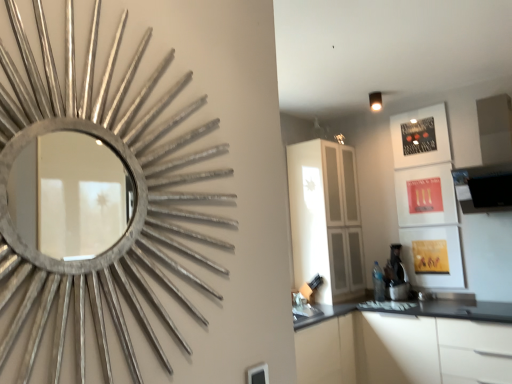
Measure the distance between silver metallic mirror at upper left and camera.

silver metallic mirror at upper left and camera are 73.79 centimeters apart from each other.

The height and width of the screenshot is (384, 512). What do you see at coordinates (396, 275) in the screenshot?
I see `black plastic coffee machine at lower right` at bounding box center [396, 275].

Measure the distance between point (300,343) and camera.

A distance of 2.94 meters exists between point (300,343) and camera.

You are a GUI agent. You are given a task and a screenshot of the screen. Output one action in this format:
    pyautogui.click(x=<x>, y=<y>)
    Task: Click on the white matte cabinet at lower right
    The height and width of the screenshot is (384, 512).
    Given the screenshot: What is the action you would take?
    [x=406, y=344]

Where is `silver metallic mirror at upper left`? The height and width of the screenshot is (384, 512). silver metallic mirror at upper left is located at coordinates (99, 206).

Which point is more distant from viewer, (390, 259) or (151, 211)?

The point (390, 259) is more distant.

Identify the location of oval that appears on the left of black plastic coffee machine at lower right. The height and width of the screenshot is (384, 512). (99, 206).

From a real-world perspective, between black plastic coffee machine at lower right and silver metallic mirror at upper left, who is vertically lower?

From a 3D spatial view, black plastic coffee machine at lower right is below.

Looking at this image, is black plastic coffee machine at lower right a part of silver metallic mirror at upper left?

Definitely not — black plastic coffee machine at lower right is not inside silver metallic mirror at upper left.

Which of these two, silver metallic mirror at upper left or black plastic coffee machine at lower right, stands shorter?

black plastic coffee machine at lower right is shorter.

Between silver metallic mirror at upper left and black plastic coffee machine at lower right, which one appears on the left side from the viewer's perspective?

silver metallic mirror at upper left.

From a real-world perspective, is white glossy cabinet at center located higher than white matte cabinet at lower right?

Yes.

Can you tell me how much white glossy cabinet at center and white matte cabinet at lower right differ in facing direction?

white glossy cabinet at center and white matte cabinet at lower right are facing 88.7 degrees away from each other.

Considering the sizes of objects white glossy cabinet at center and white matte cabinet at lower right in the image provided, who is bigger, white glossy cabinet at center or white matte cabinet at lower right?

white matte cabinet at lower right is bigger.

Is white matte cabinet at lower right at the back of white glossy cabinet at center?

white glossy cabinet at center is not turned away from white matte cabinet at lower right.

Is white matte cabinet at lower right touching white glossy cabinet at center?

No, white matte cabinet at lower right is not making contact with white glossy cabinet at center.

From a real-world perspective, who is located lower, white matte cabinet at lower right or white glossy cabinet at center?

In real-world perspective, white matte cabinet at lower right is lower.

Considering the sizes of white matte cabinet at lower right and white glossy cabinet at center in the image, is white matte cabinet at lower right wider or thinner than white glossy cabinet at center?

In the image, white matte cabinet at lower right appears to be wider than white glossy cabinet at center.

Does white matte cabinet at lower right have a larger size compared to white glossy cabinet at center?

Yes.

From the image's perspective, does black plastic coffee machine at lower right appear lower than white glossy cabinet at center?

Yes, from the image's perspective, black plastic coffee machine at lower right is beneath white glossy cabinet at center.

Between black plastic coffee machine at lower right and white glossy cabinet at center, which one appears on the left side from the viewer's perspective?

white glossy cabinet at center.

Considering the relative sizes of black plastic coffee machine at lower right and white glossy cabinet at center in the image provided, is black plastic coffee machine at lower right smaller than white glossy cabinet at center?

Yes, black plastic coffee machine at lower right is smaller than white glossy cabinet at center.

Are black plastic coffee machine at lower right and white glossy cabinet at center making contact?

No, black plastic coffee machine at lower right is not next to white glossy cabinet at center.

Looking at their sizes, would you say silver metallic mirror at upper left is wider or thinner than white matte cabinet at lower right?

Clearly, silver metallic mirror at upper left has less width compared to white matte cabinet at lower right.

What's the angular difference between silver metallic mirror at upper left and white matte cabinet at lower right's facing directions?

The facing directions of silver metallic mirror at upper left and white matte cabinet at lower right are 89.9 degrees apart.

Is silver metallic mirror at upper left not inside white matte cabinet at lower right?

silver metallic mirror at upper left is positioned outside white matte cabinet at lower right.

From a real-world perspective, who is located higher, silver metallic mirror at upper left or white matte cabinet at lower right?

silver metallic mirror at upper left.

Is white matte cabinet at lower right positioned before black plastic coffee machine at lower right?

Yes.

Can you confirm if white matte cabinet at lower right is bigger than black plastic coffee machine at lower right?

Yes, white matte cabinet at lower right is bigger than black plastic coffee machine at lower right.

The image size is (512, 384). I want to click on coffee machine that is behind the white matte cabinet at lower right, so click(x=396, y=275).

From a real-world perspective, is white matte cabinet at lower right located higher than black plastic coffee machine at lower right?

No.

Locate an element on the screen. The height and width of the screenshot is (384, 512). coffee machine that appears on the right of silver metallic mirror at upper left is located at coordinates point(396,275).

Identify the location of oval above the black plastic coffee machine at lower right (from a real-world perspective). The width and height of the screenshot is (512, 384). click(x=99, y=206).

Looking at the image, which one is located further to black plastic coffee machine at lower right, white glossy cabinet at center or white matte cabinet at lower right?

white matte cabinet at lower right lies further to black plastic coffee machine at lower right than the other object.

Estimate the real-world distances between objects in this image. Which object is closer to white matte cabinet at lower right, silver metallic mirror at upper left or white glossy cabinet at center?

Among the two, white glossy cabinet at center is located nearer to white matte cabinet at lower right.

Which object lies nearer to the anchor point white matte cabinet at lower right, black plastic coffee machine at lower right or silver metallic mirror at upper left?

black plastic coffee machine at lower right.

Considering their positions, is silver metallic mirror at upper left positioned further to black plastic coffee machine at lower right than white glossy cabinet at center?

The object further to black plastic coffee machine at lower right is silver metallic mirror at upper left.

Based on their spatial positions, is white glossy cabinet at center or silver metallic mirror at upper left closer to white matte cabinet at lower right?

Based on the image, white glossy cabinet at center appears to be nearer to white matte cabinet at lower right.

Estimate the real-world distances between objects in this image. Which object is further from white glossy cabinet at center, white matte cabinet at lower right or silver metallic mirror at upper left?

silver metallic mirror at upper left is positioned further to the anchor white glossy cabinet at center.

Based on their spatial positions, is white glossy cabinet at center or black plastic coffee machine at lower right further from white matte cabinet at lower right?

white glossy cabinet at center is further to white matte cabinet at lower right.

From the image, which object appears to be nearer to silver metallic mirror at upper left, white glossy cabinet at center or black plastic coffee machine at lower right?

white glossy cabinet at center is positioned closer to the anchor silver metallic mirror at upper left.

This screenshot has width=512, height=384. I want to click on cabinetry between silver metallic mirror at upper left and black plastic coffee machine at lower right in the front-back direction, so click(406, 344).

Locate an element on the screen. This screenshot has height=384, width=512. dresser between white matte cabinet at lower right and black plastic coffee machine at lower right in the front-back direction is located at coordinates (326, 219).

At what (x,y) coordinates should I click in order to perform the action: click on cabinetry between silver metallic mirror at upper left and white glossy cabinet at center along the z-axis. Please return your answer as a coordinate pair (x, y). The image size is (512, 384). Looking at the image, I should click on (406, 344).

In order to click on dresser between silver metallic mirror at upper left and black plastic coffee machine at lower right in the front-back direction in this screenshot , I will do `click(326, 219)`.